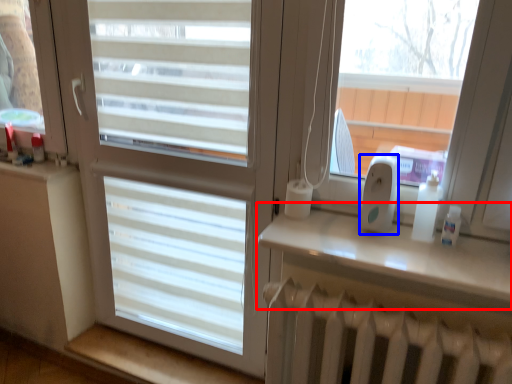
Question: Which point is closer to the camera, window sill (highlighted by a red box) or ipod (highlighted by a blue box)?

Choices:
 (A) window sill
 (B) ipod

Answer: (A)